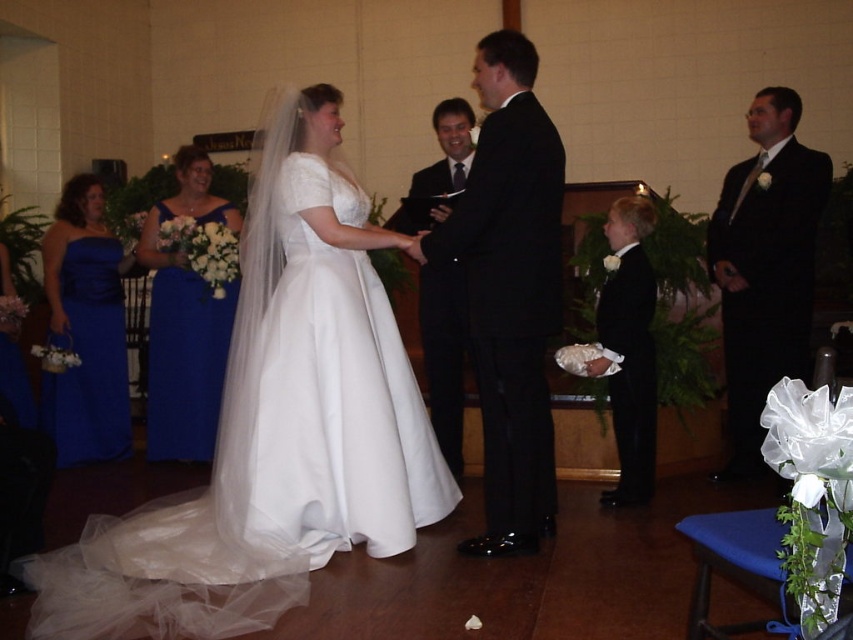
You are a photographer at a wedding. You need to capture a photo of the black satin suit at right and the blue satin dress at left. The camera you are using has a maximum focus range of 3 meters. Will you be able to get both subjects in focus at the same time?

The black satin suit at right and blue satin dress at left are 3.33 meters apart. Since the camera can only focus up to 3 meters, the distance between them is too great for both to be in focus simultaneously.

You are a photographer at a wedding ceremony. You need to capture a closeup shot of the shiny black suit at center and the black satin suit at center. Which one is located lower in the image?

The shiny black suit at center is positioned under the black satin suit at center, so it is located lower in the image.

You are a photographer at a wedding ceremony. You need to position yourself so that both the white satin dress at center and the black satin suit at center are visible in your shot. Based on their positions, which one should you focus on first to ensure both are in frame?

The white satin dress at center is located below the black satin suit at center, so you should focus on the black satin suit at center first to ensure both are in frame.